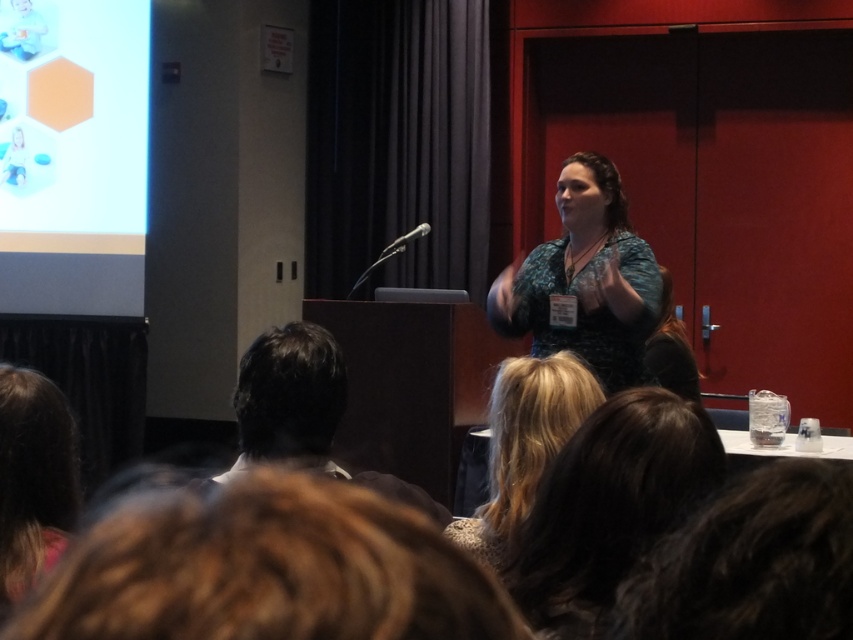
In the presentation scene, you notice two audience members with distinct hair colors. The brown hair at lower left and the blonde hair at center. Which of these two has shorter hair?

The brown hair at lower left is shorter than the blonde hair at center.

You are an attendee at the presentation. You notice the matte green dress at center and the dark brown hair at lower left. Which object is positioned more to the left side of the image?

The dark brown hair at lower left is positioned more to the left side of the image than the matte green dress at center.

You are an attendee at the presentation and want to know which of the two points, point (447,636) or point (540,378), is closer to you. Can you determine this based on the scene?

Point (447,636) is closer to the viewer than point (540,378), so the point you see closer is point (447,636).